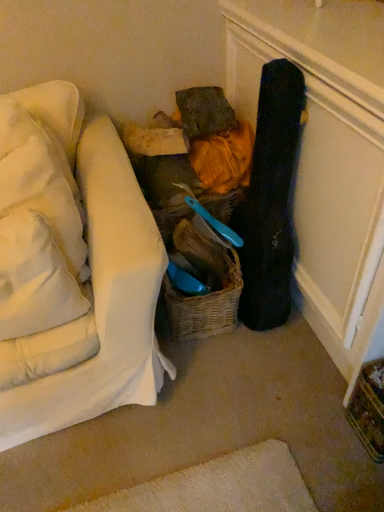
Question: Should I look upward or downward to see woven brown basket at center, marked as the second basket in a bottom-to-top arrangement?

Choices:
 (A) up
 (B) down

Answer: (A)

Question: Should I look upward or downward to see woven brown basket at center, placed as the first basket when sorted from bottom to top?

Choices:
 (A) up
 (B) down

Answer: (B)

Question: Is white soft pillow at upper left, the third pillow from the bottom, aimed at white soft pillow at left, arranged as the 2th pillow when ordered from the bottom?

Choices:
 (A) yes
 (B) no

Answer: (A)

Question: Is white soft pillow at upper left, the third pillow from the bottom, at the left side of white soft pillow at left, positioned as the 2th pillow in top-to-bottom order?

Choices:
 (A) no
 (B) yes

Answer: (B)

Question: From the image's perspective, is white soft pillow at upper left, the third pillow from the bottom, above white soft pillow at left, arranged as the 2th pillow when ordered from the bottom?

Choices:
 (A) no
 (B) yes

Answer: (B)

Question: From a real-world perspective, is white soft pillow at upper left, the third pillow from the bottom, beneath white soft pillow at left, positioned as the 2th pillow in top-to-bottom order?

Choices:
 (A) no
 (B) yes

Answer: (A)

Question: Is white soft pillow at upper left, the third pillow from the bottom, bigger than white soft pillow at left, positioned as the 2th pillow in top-to-bottom order?

Choices:
 (A) no
 (B) yes

Answer: (A)

Question: Considering the relative positions of white soft pillow at upper left, which is counted as the 1th pillow, starting from the top, and white soft pillow at left, positioned as the 2th pillow in top-to-bottom order, in the image provided, is white soft pillow at upper left, which is counted as the 1th pillow, starting from the top, in front of white soft pillow at left, positioned as the 2th pillow in top-to-bottom order,?

Choices:
 (A) no
 (B) yes

Answer: (A)

Question: Can you confirm if woven brown basket at center, placed as the 2th basket when sorted from top to bottom, is thinner than black matte guitar case at right?

Choices:
 (A) yes
 (B) no

Answer: (B)

Question: Is woven brown basket at center, placed as the 2th basket when sorted from top to bottom, far away from black matte guitar case at right?

Choices:
 (A) no
 (B) yes

Answer: (A)

Question: Is black matte guitar case at right inside woven brown basket at center, placed as the 2th basket when sorted from top to bottom?

Choices:
 (A) no
 (B) yes

Answer: (A)

Question: From a real-world perspective, does woven brown basket at center, placed as the first basket when sorted from bottom to top, stand above black matte guitar case at right?

Choices:
 (A) yes
 (B) no

Answer: (B)

Question: Does woven brown basket at center, placed as the first basket when sorted from bottom to top, turn towards black matte guitar case at right?

Choices:
 (A) yes
 (B) no

Answer: (B)

Question: Is woven brown basket at center, placed as the first basket when sorted from bottom to top, next to black matte guitar case at right and touching it?

Choices:
 (A) no
 (B) yes

Answer: (A)

Question: Is black matte guitar case at right facing away from white soft pillow at left, marked as the first pillow in a bottom-to-top arrangement?

Choices:
 (A) no
 (B) yes

Answer: (A)